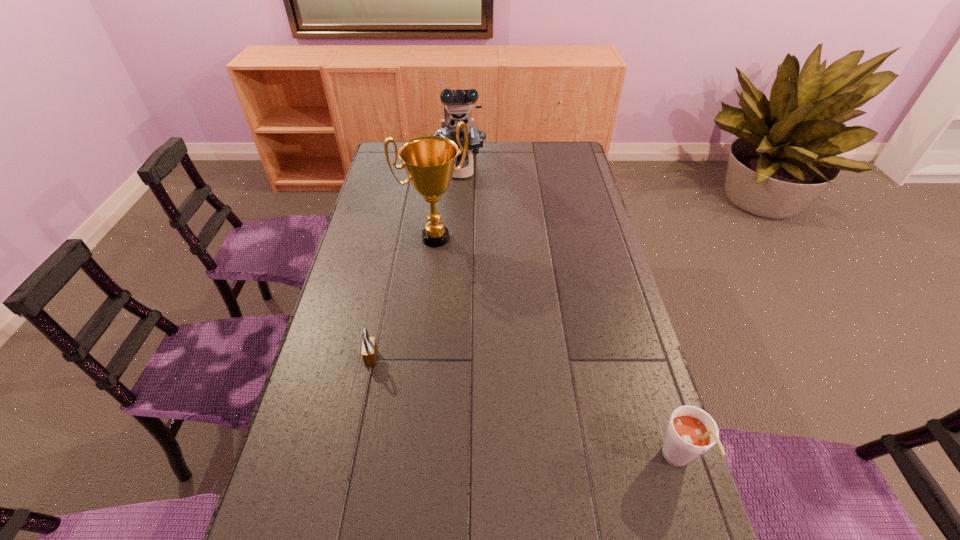
You are a GUI agent. You are given a task and a screenshot of the screen. Output one action in this format:
    pyautogui.click(x=<x>, y=<y>)
    Task: Click on the vacant space on the desktop that is between the third farthest object and the root beer and is positioned on the front view with handles of the third nearest object
    The image size is (960, 540).
    Given the screenshot: What is the action you would take?
    pyautogui.click(x=550, y=418)

The image size is (960, 540). What are the coordinates of `free space on the desktop that is between the leftmost object and the nearest object and is positioned through the eyepieces of the farthest object` in the screenshot? It's located at pyautogui.click(x=481, y=395).